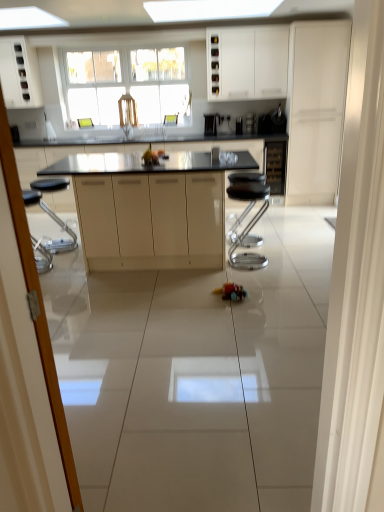
Image resolution: width=384 pixels, height=512 pixels. Identify the location of black granite countertop at center. click(x=84, y=156).

At what (x,y) coordinates should I click in order to perform the action: click on black glass wine cabinet at center, marked as the 4th cabinetry in a left-to-right arrangement. Please return your answer as a coordinate pair (x, y). The height and width of the screenshot is (512, 384). Looking at the image, I should click on (275, 166).

Describe the element at coordinates (250, 123) in the screenshot. I see `glossy stainless steel wine cooler at center, the 1th appliance from the right` at that location.

This screenshot has width=384, height=512. What do you see at coordinates (248, 223) in the screenshot? I see `metallic silver bar stool at center` at bounding box center [248, 223].

Locate an element on the screen. white matte cabinet at right, which is the 1th cabinetry in right-to-left order is located at coordinates (316, 109).

Does point (253, 117) come farther from viewer compared to point (48, 330)?

Yes, point (253, 117) is behind point (48, 330).

In terms of height, does glossy stainless steel wine cooler at center, arranged as the third appliance when viewed from the left, look taller or shorter compared to transparent glass screen door at left?

Clearly, glossy stainless steel wine cooler at center, arranged as the third appliance when viewed from the left, is shorter compared to transparent glass screen door at left.

From the picture: Is glossy stainless steel wine cooler at center, the 1th appliance from the right, smaller than transparent glass screen door at left?

Correct, glossy stainless steel wine cooler at center, the 1th appliance from the right, occupies less space than transparent glass screen door at left.

Image resolution: width=384 pixels, height=512 pixels. Find the location of `screen door on the left of glossy stainless steel wine cooler at center, arranged as the third appliance when viewed from the left`. screen door on the left of glossy stainless steel wine cooler at center, arranged as the third appliance when viewed from the left is located at coordinates (39, 305).

Is point (113, 267) behind point (217, 118)?

No, it is in front of (217, 118).

Choose the correct answer: Is matte beige cabinetry at center, the 4th cabinetry in the right-to-left sequence, inside satin black wine cooler at upper center, marked as the third appliance in a right-to-left arrangement, or outside it?

matte beige cabinetry at center, the 4th cabinetry in the right-to-left sequence, lies outside satin black wine cooler at upper center, marked as the third appliance in a right-to-left arrangement.

Considering the sizes of objects matte beige cabinetry at center, the 4th cabinetry in the right-to-left sequence, and satin black wine cooler at upper center, which ranks as the first appliance in left-to-right order, in the image provided, who is taller, matte beige cabinetry at center, the 4th cabinetry in the right-to-left sequence, or satin black wine cooler at upper center, which ranks as the first appliance in left-to-right order,?

Standing taller between the two is matte beige cabinetry at center, the 4th cabinetry in the right-to-left sequence.

From the image's perspective, relative to satin black wine cooler at upper center, marked as the third appliance in a right-to-left arrangement, is matte beige cabinetry at center, the 4th cabinetry in the right-to-left sequence, above or below?

matte beige cabinetry at center, the 4th cabinetry in the right-to-left sequence, is situated lower than satin black wine cooler at upper center, marked as the third appliance in a right-to-left arrangement, in the image.

Is transparent glass screen door at left not near matte beige cabinetry at center, the 4th cabinetry in the right-to-left sequence?

Yes, transparent glass screen door at left is far from matte beige cabinetry at center, the 4th cabinetry in the right-to-left sequence.

Is transparent glass screen door at left outside of matte beige cabinetry at center, arranged as the 2th cabinetry when viewed from the left?

transparent glass screen door at left lies outside matte beige cabinetry at center, arranged as the 2th cabinetry when viewed from the left,'s area.

Considering the positions of objects transparent glass screen door at left and matte beige cabinetry at center, the 4th cabinetry in the right-to-left sequence, in the image provided, who is behind, transparent glass screen door at left or matte beige cabinetry at center, the 4th cabinetry in the right-to-left sequence,?

matte beige cabinetry at center, the 4th cabinetry in the right-to-left sequence, is further away from the camera.

Between transparent glass screen door at left and matte beige cabinetry at center, arranged as the 2th cabinetry when viewed from the left, which one has larger width?

matte beige cabinetry at center, arranged as the 2th cabinetry when viewed from the left, is wider.

Considering the relative sizes of matte beige cabinetry at center, arranged as the 2th cabinetry when viewed from the left, and black granite countertop at center in the image provided, is matte beige cabinetry at center, arranged as the 2th cabinetry when viewed from the left, taller than black granite countertop at center?

Yes, matte beige cabinetry at center, arranged as the 2th cabinetry when viewed from the left, is taller than black granite countertop at center.

Is matte beige cabinetry at center, the 4th cabinetry in the right-to-left sequence, to the right of black granite countertop at center from the viewer's perspective?

Correct, you'll find matte beige cabinetry at center, the 4th cabinetry in the right-to-left sequence, to the right of black granite countertop at center.

How many degrees apart are the facing directions of matte beige cabinetry at center, the 4th cabinetry in the right-to-left sequence, and black granite countertop at center?

There is a 90-degree angle between the facing directions of matte beige cabinetry at center, the 4th cabinetry in the right-to-left sequence, and black granite countertop at center.

How distant is matte beige cabinetry at center, the 4th cabinetry in the right-to-left sequence, from black granite countertop at center?

5.98 feet.

Is shiny plastic toy car at center completely or partially outside of satin black coffee machine at center, which appears as the second appliance when viewed from the left?

Yes, shiny plastic toy car at center is outside of satin black coffee machine at center, which appears as the second appliance when viewed from the left.

Measure the distance from shiny plastic toy car at center to satin black coffee machine at center, the second appliance viewed from the right.

A distance of 10.70 feet exists between shiny plastic toy car at center and satin black coffee machine at center, the second appliance viewed from the right.

From a real-world perspective, who is located lower, shiny plastic toy car at center or satin black coffee machine at center, the second appliance viewed from the right?

shiny plastic toy car at center is physically lower.

From the image's perspective, does shiny plastic toy car at center appear higher than satin black coffee machine at center, which appears as the second appliance when viewed from the left?

No, from the image's perspective, shiny plastic toy car at center is not on top of satin black coffee machine at center, which appears as the second appliance when viewed from the left.

Does white matte cabinet at right, which is the 1th cabinetry in right-to-left order, appear on the right side of matte beige cabinetry at center, the 4th cabinetry in the right-to-left sequence?

Yes, white matte cabinet at right, which is the 1th cabinetry in right-to-left order, is to the right of matte beige cabinetry at center, the 4th cabinetry in the right-to-left sequence.

Considering the sizes of objects white matte cabinet at right, which is the 1th cabinetry in right-to-left order, and matte beige cabinetry at center, the 4th cabinetry in the right-to-left sequence, in the image provided, who is taller, white matte cabinet at right, which is the 1th cabinetry in right-to-left order, or matte beige cabinetry at center, the 4th cabinetry in the right-to-left sequence,?

Standing taller between the two is white matte cabinet at right, which is the 1th cabinetry in right-to-left order.

Could you tell me if white matte cabinet at right, which is the 1th cabinetry in right-to-left order, is turned towards matte beige cabinetry at center, arranged as the 2th cabinetry when viewed from the left?

No, white matte cabinet at right, which is the 1th cabinetry in right-to-left order, is not aimed at matte beige cabinetry at center, arranged as the 2th cabinetry when viewed from the left.

Is white matte cabinet at right, which is the 1th cabinetry in right-to-left order, behind matte beige cabinetry at center, the 4th cabinetry in the right-to-left sequence?

That is True.

Which is closer, (x=204, y=184) or (x=266, y=146)?

Positioned in front is point (x=204, y=184).

Is matte beige cabinetry at center, the 4th cabinetry in the right-to-left sequence, not close to black glass wine cabinet at center, marked as the 4th cabinetry in a left-to-right arrangement?

Yes.

From the image's perspective, is matte beige cabinetry at center, arranged as the 2th cabinetry when viewed from the left, above or below black glass wine cabinet at center, acting as the second cabinetry starting from the right?

matte beige cabinetry at center, arranged as the 2th cabinetry when viewed from the left, is below black glass wine cabinet at center, acting as the second cabinetry starting from the right.

Measure the distance from matte beige cabinetry at center, arranged as the 2th cabinetry when viewed from the left, to black glass wine cabinet at center, marked as the 4th cabinetry in a left-to-right arrangement.

The distance of matte beige cabinetry at center, arranged as the 2th cabinetry when viewed from the left, from black glass wine cabinet at center, marked as the 4th cabinetry in a left-to-right arrangement, is 2.62 meters.

Locate an element on the screen. The width and height of the screenshot is (384, 512). the 3rd appliance to the right of the transparent glass screen door at left, starting your count from the anchor is located at coordinates (250, 123).

Where is `the 5th cabinetry in front of the satin black wine cooler at upper center, which ranks as the first appliance in left-to-right order, counting from the anchor's position`? the 5th cabinetry in front of the satin black wine cooler at upper center, which ranks as the first appliance in left-to-right order, counting from the anchor's position is located at coordinates (151, 220).

Which object lies further to the anchor point satin black coffee machine at center, the second appliance viewed from the right, glossy stainless steel wine cooler at center, the 1th appliance from the right, or satin black wine cooler at upper center, marked as the third appliance in a right-to-left arrangement?

satin black wine cooler at upper center, marked as the third appliance in a right-to-left arrangement, is positioned further to the anchor satin black coffee machine at center, the second appliance viewed from the right.

Based on their spatial positions, is white matte cabinet at upper left, the 5th cabinetry positioned from the right, or metallic silver bar stool at center closer to satin black coffee machine at center, the second appliance viewed from the right?

metallic silver bar stool at center.

In the scene shown: From the image, which object appears to be nearer to matte beige cabinetry at center, arranged as the 2th cabinetry when viewed from the left, satin black wine cooler at upper center, marked as the third appliance in a right-to-left arrangement, or satin black coffee machine at center, which appears as the second appliance when viewed from the left?

Based on the image, satin black coffee machine at center, which appears as the second appliance when viewed from the left, appears to be nearer to matte beige cabinetry at center, arranged as the 2th cabinetry when viewed from the left.

Estimate the real-world distances between objects in this image. Which object is closer to matte beige cabinetry at center, the 4th cabinetry in the right-to-left sequence, transparent glass screen door at left or glossy stainless steel wine cooler at center, the 1th appliance from the right?

transparent glass screen door at left.

Looking at the image, which one is located closer to white matte cabinet at upper left, placed as the first cabinetry when sorted from left to right, metallic silver bar stool at center or black granite countertop at center?

black granite countertop at center lies closer to white matte cabinet at upper left, placed as the first cabinetry when sorted from left to right, than the other object.

Looking at the image, which one is located closer to matte beige cabinetry at center, arranged as the 2th cabinetry when viewed from the left, shiny plastic toy car at center or white matte cabinet at upper center, which is the 3th cabinetry from left to right?

shiny plastic toy car at center is positioned closer to the anchor matte beige cabinetry at center, arranged as the 2th cabinetry when viewed from the left.

Looking at the image, which one is located further to black glass wine cabinet at center, acting as the second cabinetry starting from the right, glossy stainless steel wine cooler at center, the 1th appliance from the right, or shiny plastic toy car at center?

shiny plastic toy car at center is positioned further to the anchor black glass wine cabinet at center, acting as the second cabinetry starting from the right.

Considering their positions, is black glass wine cabinet at center, acting as the second cabinetry starting from the right, positioned closer to satin black wine cooler at upper center, which ranks as the first appliance in left-to-right order, than matte beige cabinetry at center, arranged as the 2th cabinetry when viewed from the left?

black glass wine cabinet at center, acting as the second cabinetry starting from the right, is positioned closer to the anchor satin black wine cooler at upper center, which ranks as the first appliance in left-to-right order.

Where is `toy between white matte cabinet at upper left, placed as the first cabinetry when sorted from left to right, and white matte cabinet at right, which is the 1th cabinetry in right-to-left order, in the horizontal direction`? The width and height of the screenshot is (384, 512). toy between white matte cabinet at upper left, placed as the first cabinetry when sorted from left to right, and white matte cabinet at right, which is the 1th cabinetry in right-to-left order, in the horizontal direction is located at coordinates (231, 292).

What are the coordinates of `bar stool located between transparent glass screen door at left and white matte cabinet at right, which ranks as the 5th cabinetry in left-to-right order, in the depth direction` in the screenshot? It's located at point(248,223).

You are a GUI agent. You are given a task and a screenshot of the screen. Output one action in this format:
    pyautogui.click(x=<x>, y=<y>)
    Task: Click on the appliance situated between satin black wine cooler at upper center, which ranks as the first appliance in left-to-right order, and glossy stainless steel wine cooler at center, arranged as the third appliance when viewed from the left, from left to right
    This screenshot has height=512, width=384.
    Given the screenshot: What is the action you would take?
    pyautogui.click(x=239, y=125)

The width and height of the screenshot is (384, 512). Find the location of `bar stool located between white matte cabinet at upper left, the 5th cabinetry positioned from the right, and glossy stainless steel wine cooler at center, the 1th appliance from the right, in the left-right direction`. bar stool located between white matte cabinet at upper left, the 5th cabinetry positioned from the right, and glossy stainless steel wine cooler at center, the 1th appliance from the right, in the left-right direction is located at coordinates (248, 223).